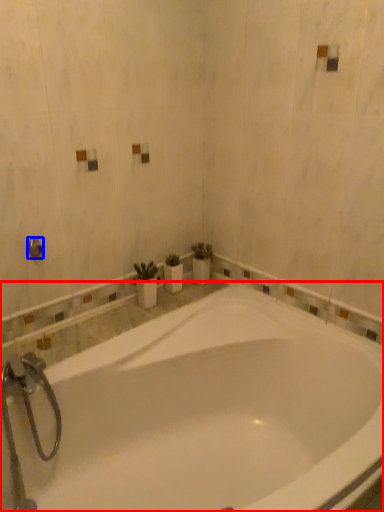
Question: Which point is closer to the camera, bathtub (highlighted by a red box) or shower (highlighted by a blue box)?

Choices:
 (A) bathtub
 (B) shower

Answer: (A)